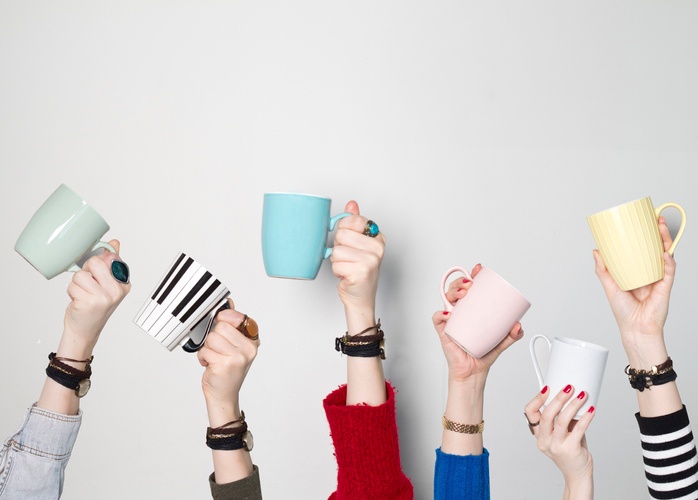
The height and width of the screenshot is (500, 698). I want to click on mug, so click(x=66, y=232), click(x=188, y=308), click(x=320, y=237), click(x=487, y=329), click(x=586, y=368), click(x=628, y=254).